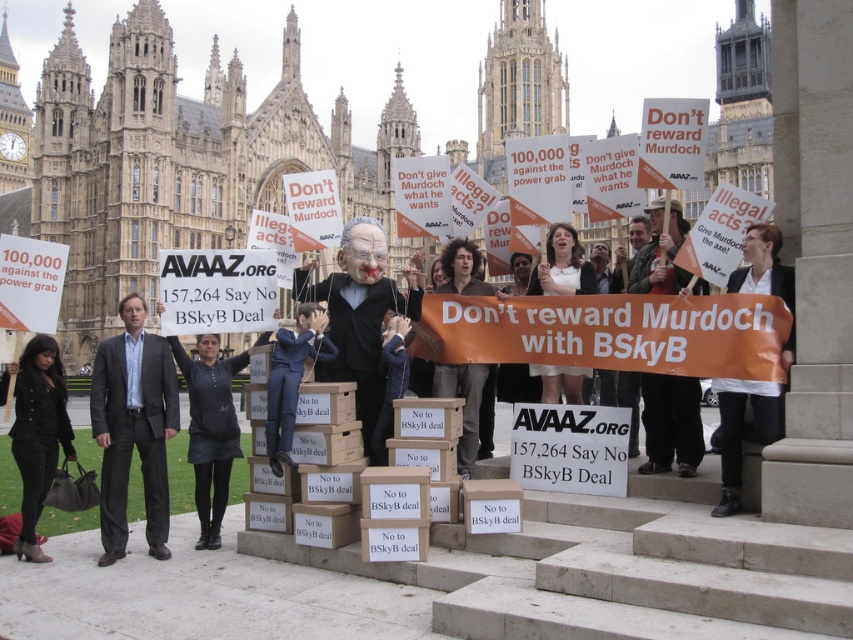
Which is below, dark gray suit at center or white shirt at center?

white shirt at center is lower down.

Does dark gray suit at center lie behind white shirt at center?

That is True.

Is point (135, 394) farther from viewer compared to point (741, 248)?

Yes, point (135, 394) is behind point (741, 248).

The width and height of the screenshot is (853, 640). Identify the location of dark gray suit at center. (132, 428).

Does point (213, 401) come behind point (277, 420)?

That is True.

Find the location of a particular element. This screenshot has width=853, height=640. black leather jacket at center is located at coordinates (210, 428).

You are a GUI agent. You are given a task and a screenshot of the screen. Output one action in this format:
    pyautogui.click(x=<x>, y=<y>)
    Task: Click on the black leather jacket at center
    The image size is (853, 640).
    Given the screenshot: What is the action you would take?
    pyautogui.click(x=210, y=428)

Between point (718, 432) and point (578, 276), which one is positioned behind?

Positioned behind is point (578, 276).

From the picture: Between white shirt at center and white fabric sign at center, which one appears on the right side from the viewer's perspective?

From the viewer's perspective, white shirt at center appears more on the right side.

Is point (752, 234) farther from viewer compared to point (567, 282)?

No.

Locate an element on the screen. The height and width of the screenshot is (640, 853). white shirt at center is located at coordinates (743, 429).